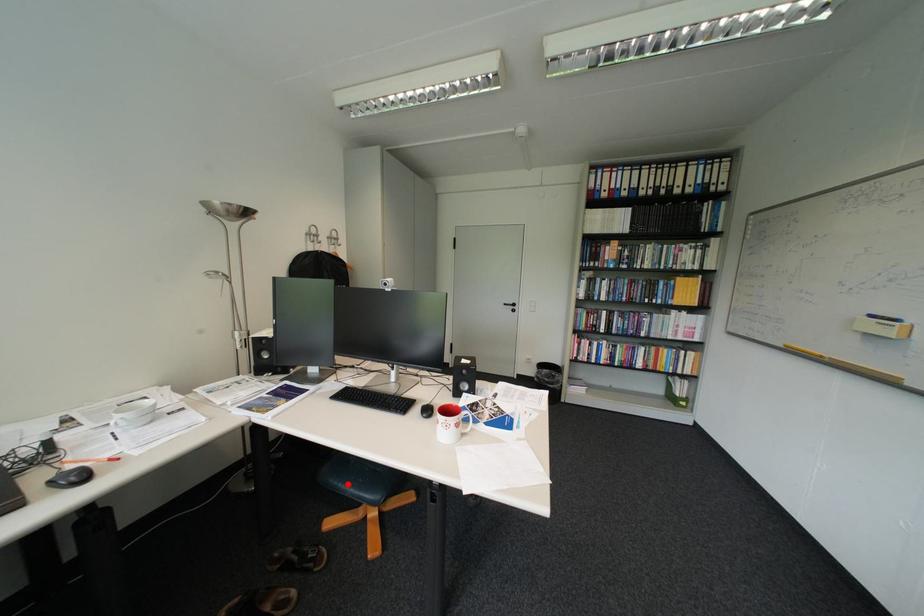
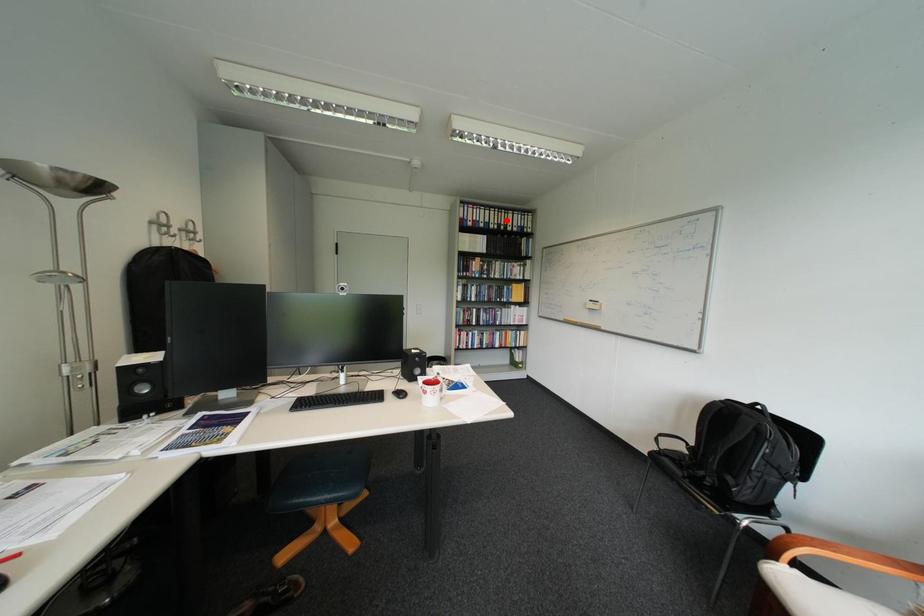
I am providing you with two images of the same scene from different viewpoints. A red point is marked on the first image and another point is marked on the second image. Does the point marked in image1 correspond to the same location as the one in image2?

No